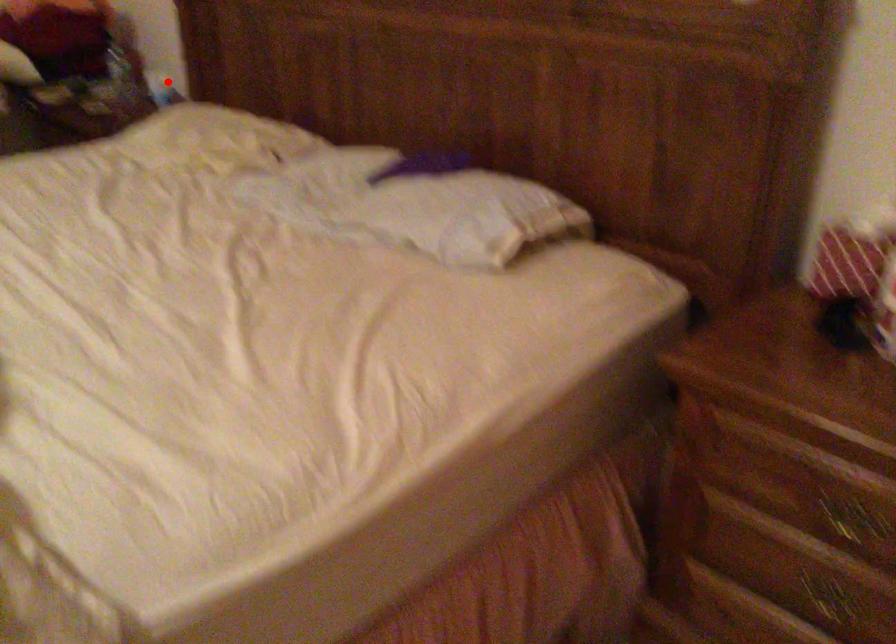
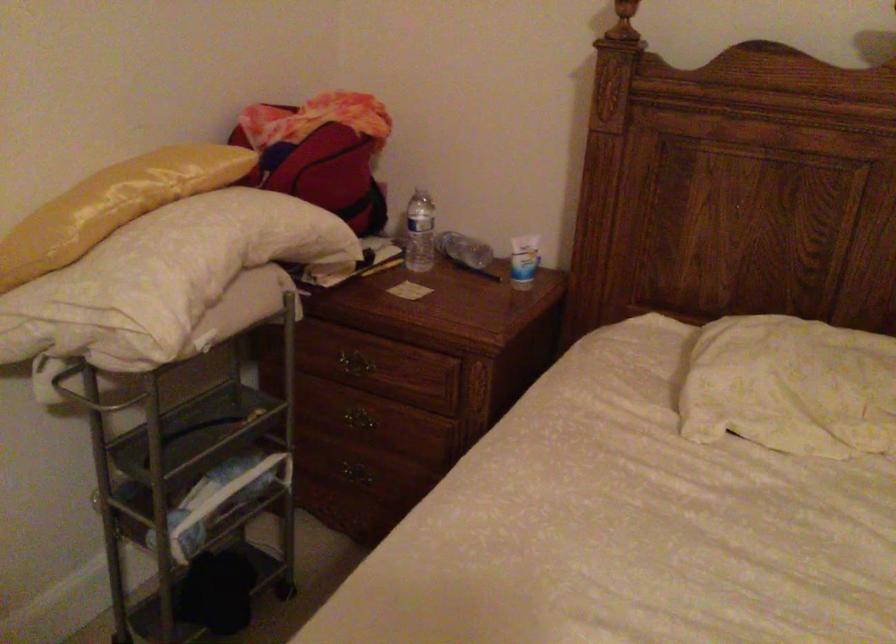
Question: I am providing you with two images of the same scene from different viewpoints. In image1, a red point is highlighted. Considering the same 3D point in image2, which of the following is correct?

Choices:
 (A) It is closer
 (B) It is farther

Answer: (A)